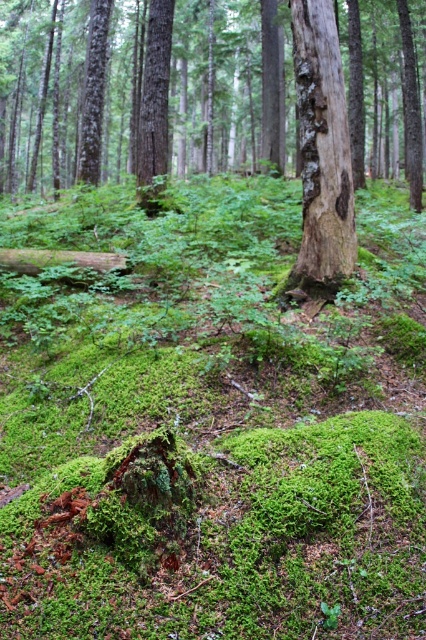
Question: Is smooth bark tree at center wider than grayish-brown bark tree trunk at center?

Choices:
 (A) no
 (B) yes

Answer: (B)

Question: Among these objects, which one is nearest to the camera?

Choices:
 (A) grayish-brown bark tree trunk at center
 (B) smooth bark tree at center

Answer: (A)

Question: Can you confirm if smooth bark tree at center is bigger than grayish-brown bark tree trunk at center?

Choices:
 (A) no
 (B) yes

Answer: (B)

Question: Can you confirm if smooth bark tree at center is bigger than grayish-brown bark tree trunk at center?

Choices:
 (A) no
 (B) yes

Answer: (B)